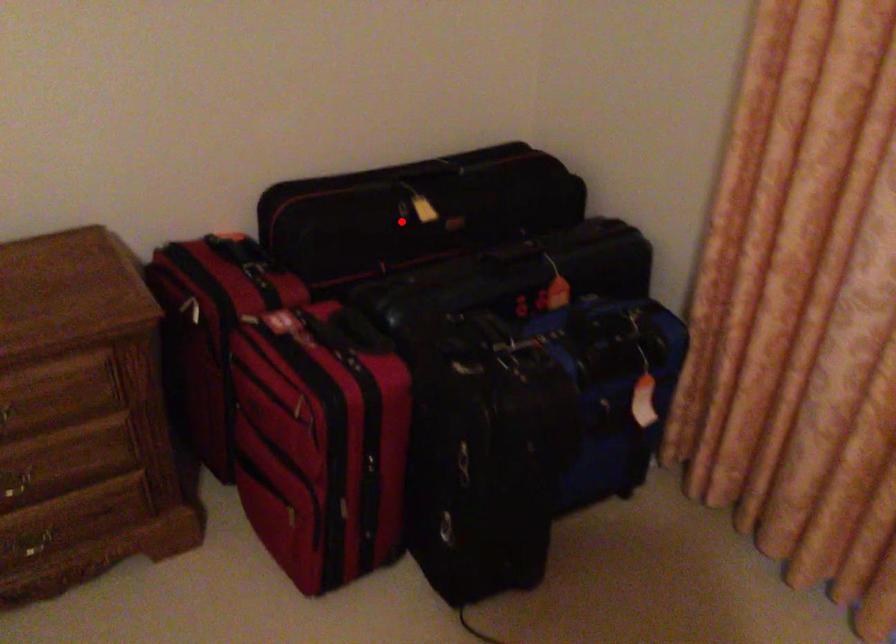
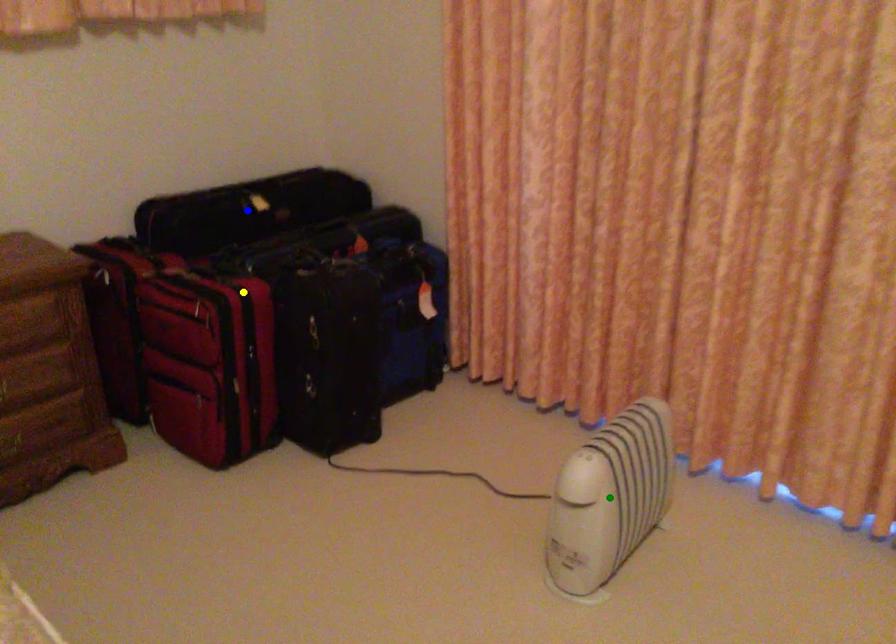
Question: I am providing you with two images of the same scene from different viewpoints. A red point is marked on the first image. You are given multiple points on the second image. Which spot in image 2 lines up with the point in image 1?

Choices:
 (A) yellow point
 (B) green point
 (C) blue point

Answer: (C)